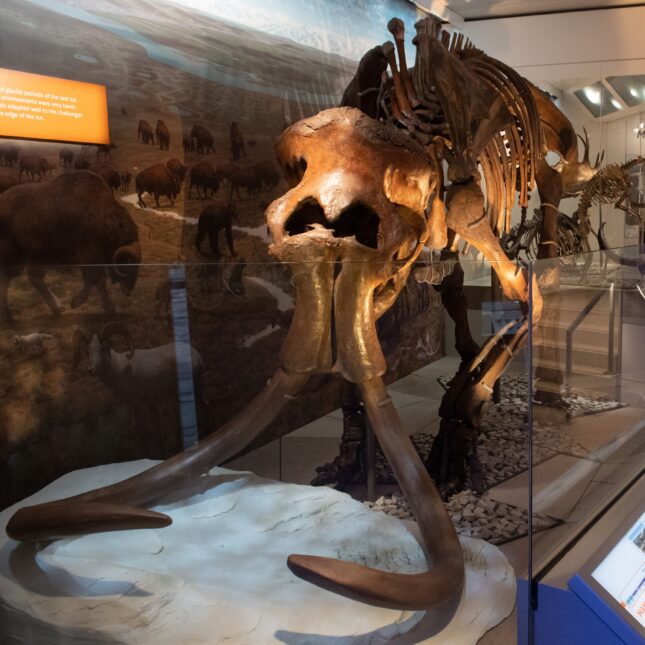
Identify the location of placard. This screenshot has width=645, height=645. (51, 124).